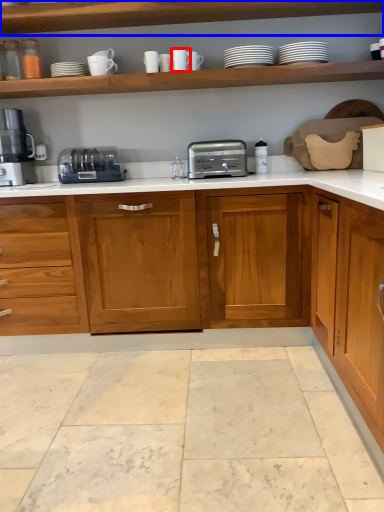
Question: Which object is closer to the camera taking this photo, tableware (highlighted by a red box) or shelf (highlighted by a blue box)?

Choices:
 (A) tableware
 (B) shelf

Answer: (B)